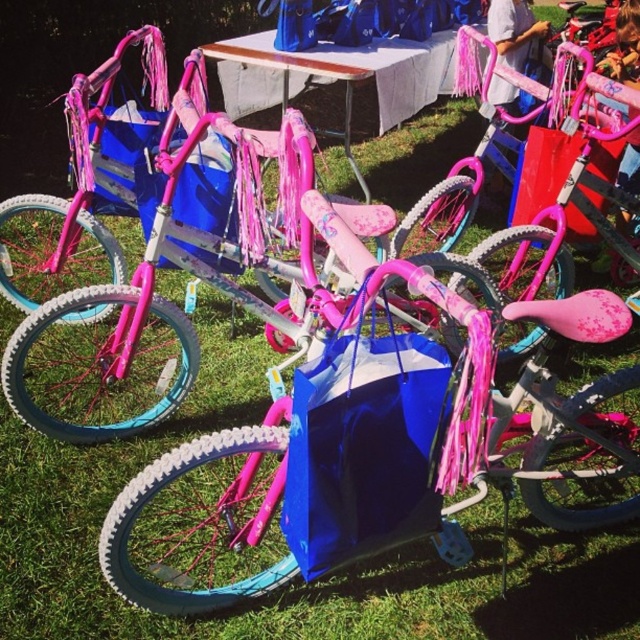
In the scene shown: You are planning to set up a small event on the grassy area where the blue glossy bag at center and the white plastic picnic table at center are located. Considering their sizes, which object would require more space to accommodate in your setup?

The white plastic picnic table at center requires more space because the blue glossy bag at center occupies less space than it.

You are planning a picnic and see the blue glossy bag at center and the white plastic picnic table at center in the image. Which object is positioned to the right side of the other?

The blue glossy bag at center is positioned to the right of the white plastic picnic table at center.